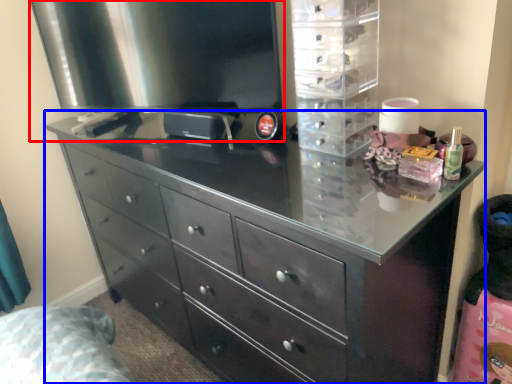
Question: Which object appears farthest to the camera in this image, appliance (highlighted by a red box) or chest of drawers (highlighted by a blue box)?

Choices:
 (A) appliance
 (B) chest of drawers

Answer: (A)